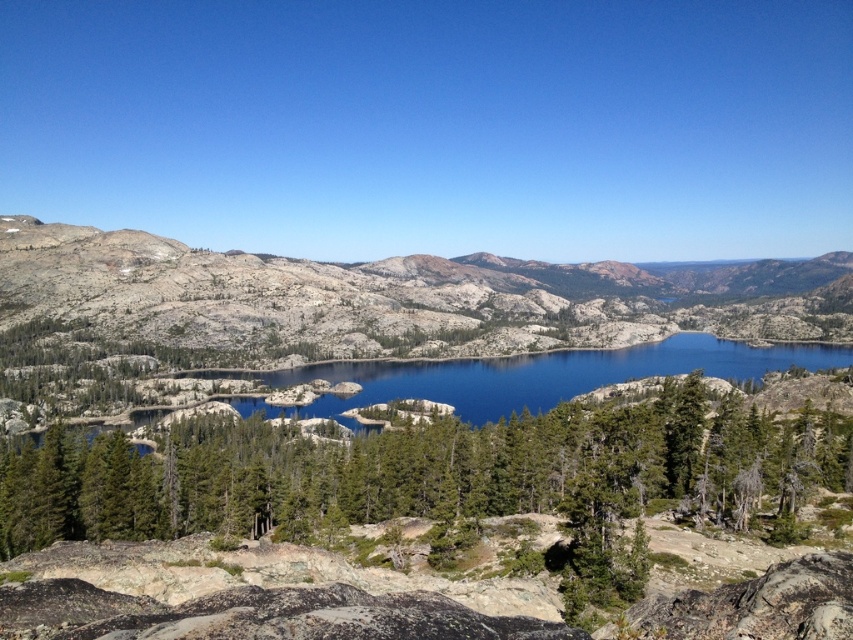
Question: Is gray granite mountain at center thinner than blue reflective water at center?

Choices:
 (A) no
 (B) yes

Answer: (A)

Question: Which of the following is the farthest from the observer?

Choices:
 (A) gray granite mountain at center
 (B) blue reflective water at center

Answer: (A)

Question: Is gray granite mountain at center in front of blue reflective water at center?

Choices:
 (A) yes
 (B) no

Answer: (B)

Question: From the image, what is the correct spatial relationship of gray granite mountain at center in relation to blue reflective water at center?

Choices:
 (A) right
 (B) left

Answer: (A)